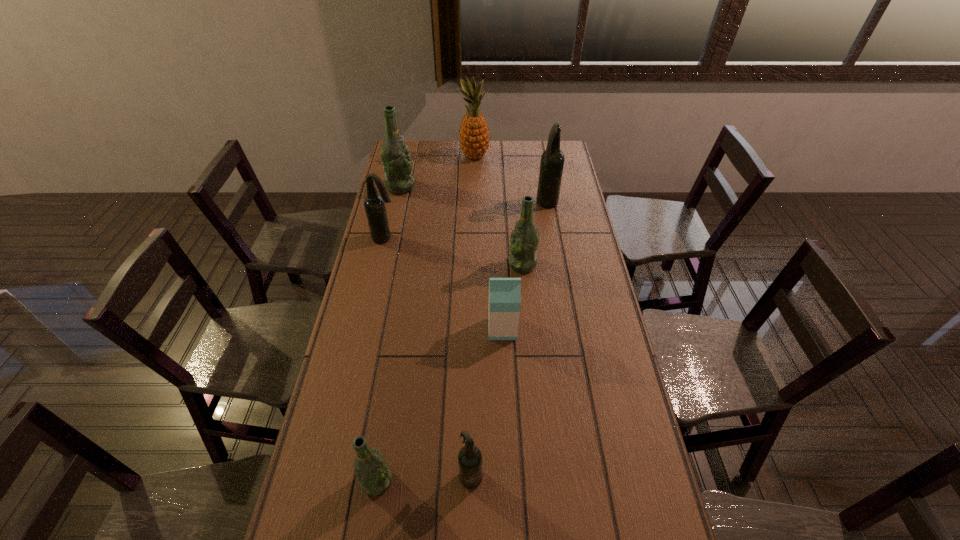
At what (x,y) coordinates should I click in order to perform the action: click on pineapple. Please return your answer as a coordinate pair (x, y). This screenshot has height=540, width=960. Looking at the image, I should click on (474, 137).

Identify the location of the biggest green beer bottle. The height and width of the screenshot is (540, 960). (395, 155).

The width and height of the screenshot is (960, 540). Identify the location of the seventh nearest object. (395, 155).

This screenshot has width=960, height=540. In order to click on the sixth nearest object in this screenshot , I will do `click(552, 160)`.

At what (x,y) coordinates should I click in order to perform the action: click on the rightmost beer bottle. Please return your answer as a coordinate pair (x, y). Looking at the image, I should click on (552, 160).

I want to click on the third nearest beer bottle, so click(524, 240).

Where is `the second biggest green beer bottle`? Image resolution: width=960 pixels, height=540 pixels. the second biggest green beer bottle is located at coordinates (524, 240).

This screenshot has width=960, height=540. I want to click on the leftmost dark beer bottle, so coord(374,204).

Image resolution: width=960 pixels, height=540 pixels. Identify the location of the second biggest dark beer bottle. (374, 204).

Where is `milk carton`? The width and height of the screenshot is (960, 540). milk carton is located at coordinates (504, 293).